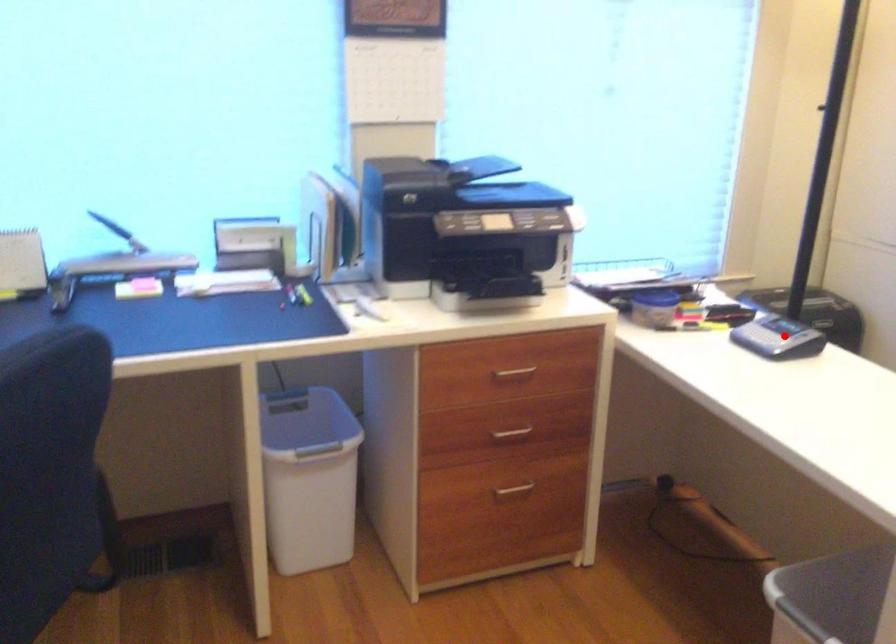
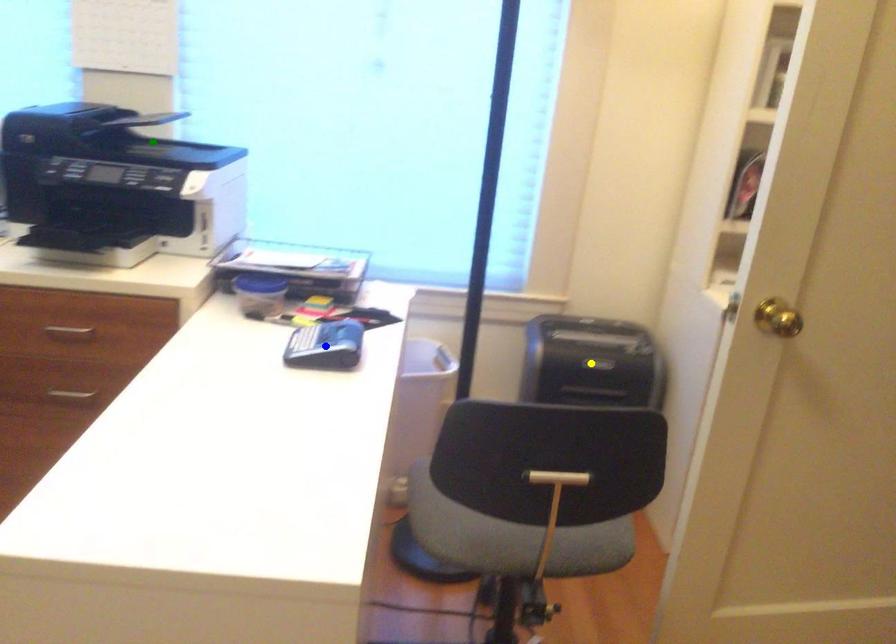
Question: I am providing you with two images of the same scene from different viewpoints. A red point is marked on the first image. You are given multiple points on the second image. Which mark in image 2 goes with the point in image 1?

Choices:
 (A) yellow point
 (B) blue point
 (C) green point

Answer: (B)